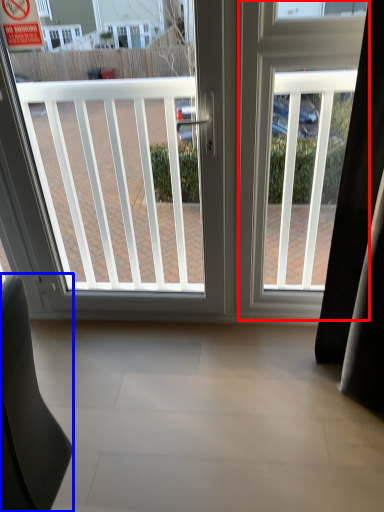
Question: Which object appears closest to the camera in this image, screen door (highlighted by a red box) or furniture (highlighted by a blue box)?

Choices:
 (A) screen door
 (B) furniture

Answer: (B)